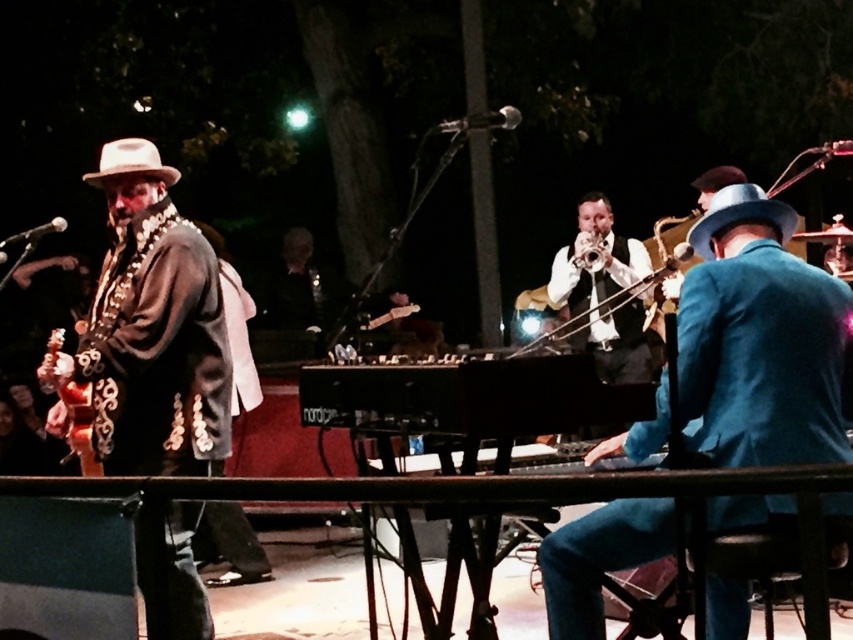
This screenshot has width=853, height=640. What are the coordinates of `light beige felt fedora at left` in the screenshot? It's located at (131, 163).

Is point (138, 141) farther from viewer compared to point (543, 337)?

Yes, it is.

Image resolution: width=853 pixels, height=640 pixels. What do you see at coordinates (131, 163) in the screenshot? I see `light beige felt fedora at left` at bounding box center [131, 163].

You are a GUI agent. You are given a task and a screenshot of the screen. Output one action in this format:
    pyautogui.click(x=<x>, y=<y>)
    Task: Click on the light beige felt fedora at left
    
    Given the screenshot: What is the action you would take?
    pyautogui.click(x=131, y=163)

Is blue velvet suit at center smaller than leather jacket at left?

Indeed, blue velvet suit at center has a smaller size compared to leather jacket at left.

Identify the location of blue velvet suit at center. The image size is (853, 640). (759, 340).

I want to click on blue velvet suit at center, so click(x=759, y=340).

Can you confirm if leather jacket at left is taller than blue felt hat at right?

Indeed, leather jacket at left has a greater height compared to blue felt hat at right.

Is leather jacket at left smaller than blue felt hat at right?

No, leather jacket at left is not smaller than blue felt hat at right.

Does point (166, 381) come in front of point (743, 198)?

That is False.

The height and width of the screenshot is (640, 853). I want to click on leather jacket at left, so click(151, 330).